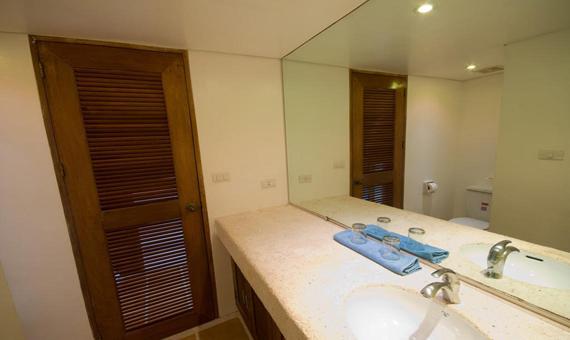
Find the location of a particular element. white oval sink is located at coordinates (394, 318).